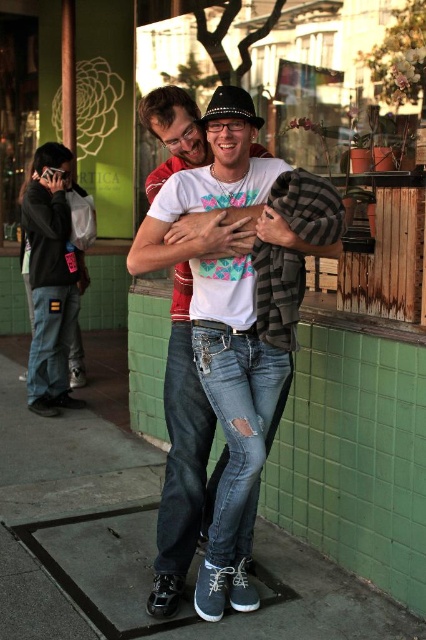
Between point (74, 611) and point (252, 221), which one is positioned in front?

Point (252, 221)

Is rough concrete sidewalk at center above white matte t-shirt at center?

No.

Does point (66, 604) come closer to viewer compared to point (250, 221)?

No, it is behind (250, 221).

At what (x,y) coordinates should I click in order to perform the action: click on rough concrete sidewalk at center. Please return your answer as a coordinate pair (x, y). Looking at the image, I should click on (230, 612).

Can you confirm if rough concrete sidewalk at center is positioned above denim pants at left?

No, rough concrete sidewalk at center is not above denim pants at left.

Is rough concrete sidewalk at center shorter than denim pants at left?

Yes.

Is point (143, 588) farther from viewer compared to point (46, 184)?

No.

You are a GUI agent. You are given a task and a screenshot of the screen. Output one action in this format:
    pyautogui.click(x=<x>, y=<y>)
    Task: Click on the rough concrete sidewalk at center
    
    Given the screenshot: What is the action you would take?
    pyautogui.click(x=230, y=612)

Does white matte t-shirt at center have a lesser height compared to denim pants at left?

Yes, white matte t-shirt at center is shorter than denim pants at left.

Who is more distant from viewer, (218,99) or (51,337)?

The point (51,337) is behind.

Identify the location of white matte t-shirt at center. This screenshot has width=426, height=640. (227, 321).